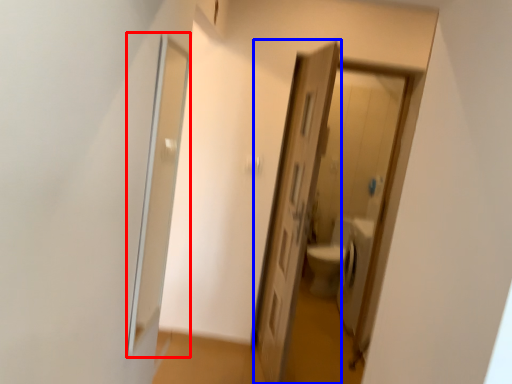
Question: Which object appears farthest to the camera in this image, screen door (highlighted by a red box) or door (highlighted by a blue box)?

Choices:
 (A) screen door
 (B) door

Answer: (B)